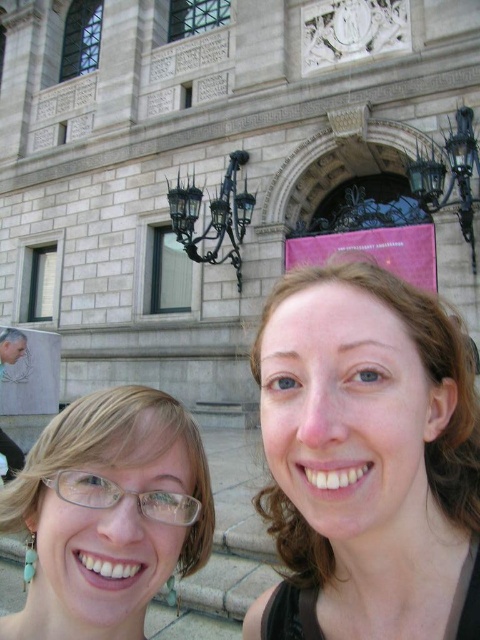
You are standing in front of the grand stone building and want to place a small decorative item between the two points labeled point (380, 586) and point (155, 582). Which point should the item be closer to in order to be positioned between them?

The item should be closer to point (155, 582) because point (380, 586) is in front of point (155, 582), meaning the latter is behind the former. Placing the item closer to the rear point ensures it is between them.

You are a photographer trying to capture a closeup of the clear plastic glasses at center and the smooth skin face at center. Which object should you focus on first if you want to ensure both are in focus, given that your camera can only focus on one subject at a time?

The smooth skin face at center is taller than the clear plastic glasses at center, so you should focus on the smooth skin face at center first since it is larger and might require more precise focusing to ensure both are in focus.